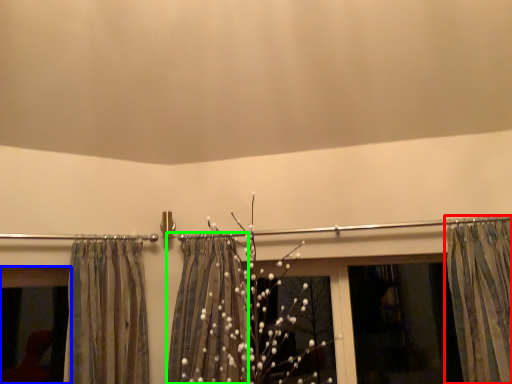
Question: Which is nearer to the curtain (highlighted by a red box)? window (highlighted by a blue box) or shower curtain (highlighted by a green box).

Choices:
 (A) window
 (B) shower curtain

Answer: (B)